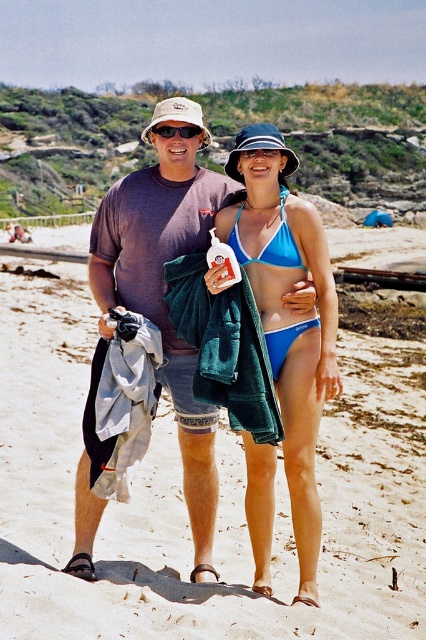
Question: Can you confirm if blue bikini at center is positioned to the right of blue matte bikini at center?

Choices:
 (A) no
 (B) yes

Answer: (B)

Question: Which point appears closest to the camera in this image?

Choices:
 (A) click(x=265, y=564)
 (B) click(x=302, y=260)

Answer: (A)

Question: Can you confirm if matte blue bikini at center is thinner than blue fabric bikini top at center?

Choices:
 (A) no
 (B) yes

Answer: (B)

Question: Which point is closer to the camera taking this photo?

Choices:
 (A) (302, 401)
 (B) (250, 237)

Answer: (A)

Question: Can you confirm if blue bikini at center is wider than blue fabric bikini top at center?

Choices:
 (A) yes
 (B) no

Answer: (A)

Question: Which object appears closest to the camera in this image?

Choices:
 (A) blue matte bikini at center
 (B) matte black sunglasses at center

Answer: (A)